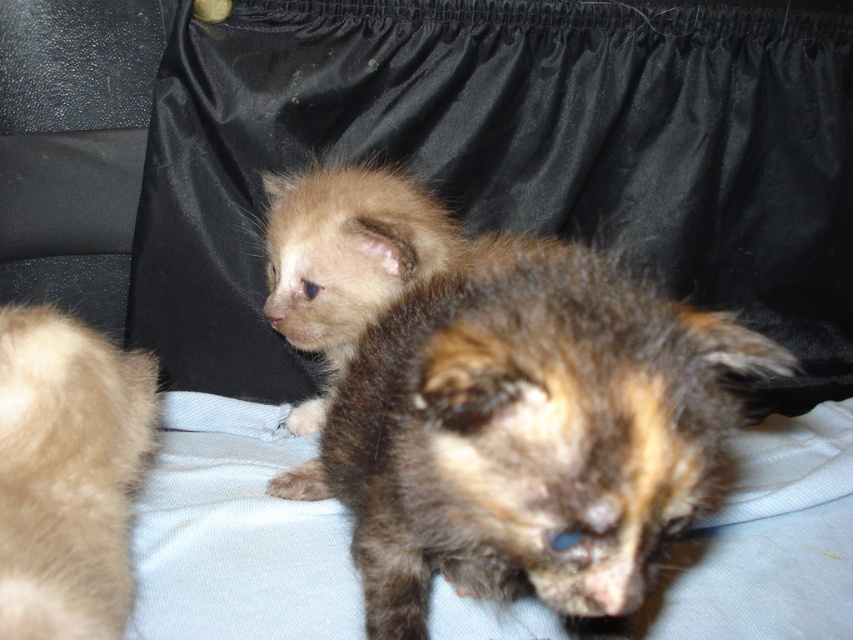
You are trying to decide whether to place a small toy between the brown fuzzy kitten at center and the light brown fur at left. Based on their positions, will the toy fit if it requires 10 cm of space?

The brown fuzzy kitten at center might be wider than light brown fur at left, so there might not be enough space for the toy requiring 10 cm. Check the actual distance before placing it.

You are looking at the image of the ferrets on the light blue fabric. There are two points marked in the image, point A at coordinates point (721, 314) and point B at coordinates point (71, 518). Which point is closer to the camera?

Point B at coordinates point (71, 518) is closer to the camera than point A at coordinates point (721, 314) because the Objects Description states that point (721, 314) is further to the camera than point (71, 518).

In the scene shown: You are a photographer trying to capture a closeup of the brown fuzzy kitten at center and the light brown fur at left. Which one should you focus on first to ensure it appears sharp in the photo?

You should focus on the brown fuzzy kitten at center first because it is closer to the viewer than the light brown fur at left, so adjusting focus starting from the closer object ensures clarity.